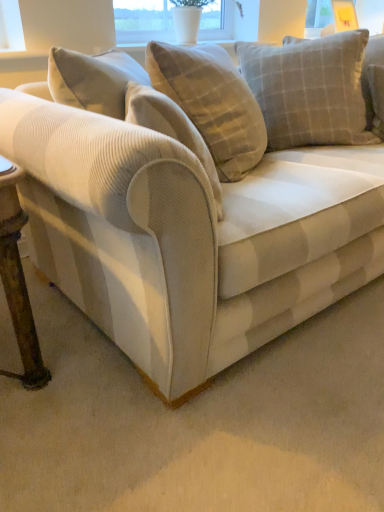
Question: Does light gray checkered cushion at upper right come in front of transparent glass window screen at upper center?

Choices:
 (A) yes
 (B) no

Answer: (A)

Question: Are light gray checkered cushion at upper right and transparent glass window screen at upper center making contact?

Choices:
 (A) no
 (B) yes

Answer: (A)

Question: Can you confirm if light gray checkered cushion at upper right is positioned to the left of transparent glass window screen at upper center?

Choices:
 (A) yes
 (B) no

Answer: (B)

Question: Can you confirm if light gray checkered cushion at upper right is bigger than transparent glass window screen at upper center?

Choices:
 (A) yes
 (B) no

Answer: (A)

Question: Considering the relative sizes of light gray checkered cushion at upper right and transparent glass window screen at upper center in the image provided, is light gray checkered cushion at upper right shorter than transparent glass window screen at upper center?

Choices:
 (A) no
 (B) yes

Answer: (A)

Question: Looking at their shapes, would you say light gray checkered cushion at upper right is wider or thinner than transparent glass window screen at upper center?

Choices:
 (A) thin
 (B) wide

Answer: (B)

Question: Is point (331, 48) closer or farther from the camera than point (203, 16)?

Choices:
 (A) closer
 (B) farther

Answer: (A)

Question: In the image, is light gray checkered cushion at upper right positioned in front of or behind transparent glass window screen at upper center?

Choices:
 (A) front
 (B) behind

Answer: (A)

Question: Do you think light gray checkered cushion at upper right is within transparent glass window screen at upper center, or outside of it?

Choices:
 (A) inside
 (B) outside

Answer: (B)

Question: Considering their positions, is transparent glass window screen at upper center located in front of or behind velvet beige couch at center?

Choices:
 (A) behind
 (B) front

Answer: (A)

Question: From the image's perspective, relative to velvet beige couch at center, is transparent glass window screen at upper center above or below?

Choices:
 (A) above
 (B) below

Answer: (A)

Question: From their relative heights in the image, would you say transparent glass window screen at upper center is taller or shorter than velvet beige couch at center?

Choices:
 (A) tall
 (B) short

Answer: (B)

Question: Is transparent glass window screen at upper center inside or outside of velvet beige couch at center?

Choices:
 (A) inside
 (B) outside

Answer: (B)

Question: From a real-world perspective, is velvet beige couch at center positioned above or below light gray checkered cushion at upper right?

Choices:
 (A) above
 (B) below

Answer: (B)

Question: Considering their positions, is velvet beige couch at center located in front of or behind light gray checkered cushion at upper right?

Choices:
 (A) behind
 (B) front

Answer: (B)